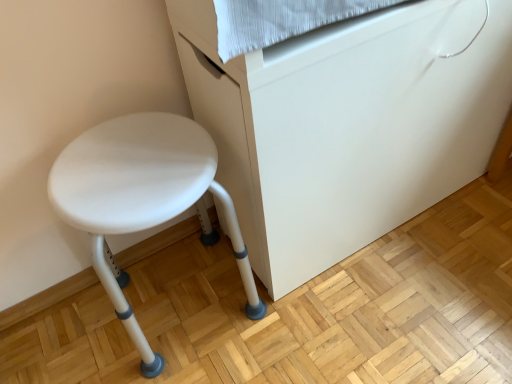
Image resolution: width=512 pixels, height=384 pixels. In order to click on vacant area that is situated to the right of white plastic stool at left in this screenshot , I will do `click(308, 321)`.